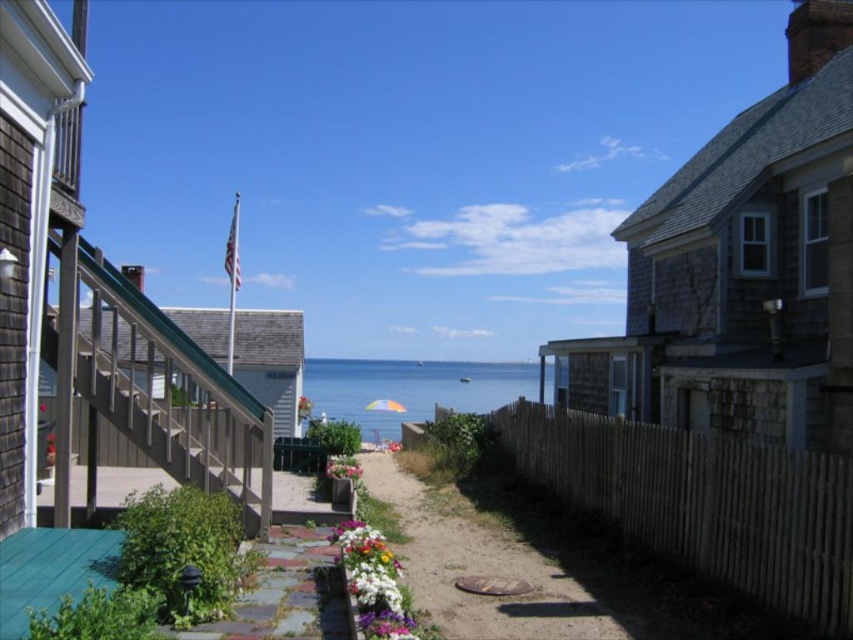
Between point (537, 449) and point (392, 387), which one is positioned behind?

Positioned behind is point (392, 387).

Is point (645, 528) farther from camera compared to point (505, 369)?

No, (645, 528) is in front of (505, 369).

The height and width of the screenshot is (640, 853). What do you see at coordinates (703, 502) in the screenshot? I see `brown wooden fence at lower right` at bounding box center [703, 502].

Find the location of `brown wooden fence at lower right`. brown wooden fence at lower right is located at coordinates (703, 502).

Is brick paved path at lower center taller than pink fabric flower at center?

No, brick paved path at lower center is not taller than pink fabric flower at center.

Does brick paved path at lower center lie behind pink fabric flower at center?

No, brick paved path at lower center is in front of pink fabric flower at center.

You are a GUI agent. You are given a task and a screenshot of the screen. Output one action in this format:
    pyautogui.click(x=<x>, y=<y>)
    Task: Click on the brick paved path at lower center
    This screenshot has height=640, width=853.
    Given the screenshot: What is the action you would take?
    pyautogui.click(x=287, y=593)

This screenshot has height=640, width=853. Find the location of `brick paved path at lower center`. brick paved path at lower center is located at coordinates (287, 593).

Does brown wooden stairs at left appear on the left side of pink fabric flower at center?

Indeed, brown wooden stairs at left is positioned on the left side of pink fabric flower at center.

Between brown wooden stairs at left and pink fabric flower at center, which one appears on the left side from the viewer's perspective?

Positioned to the left is brown wooden stairs at left.

Where is `brown wooden stairs at left`? brown wooden stairs at left is located at coordinates (177, 417).

This screenshot has width=853, height=640. In order to click on brown wooden stairs at left in this screenshot , I will do `click(177, 417)`.